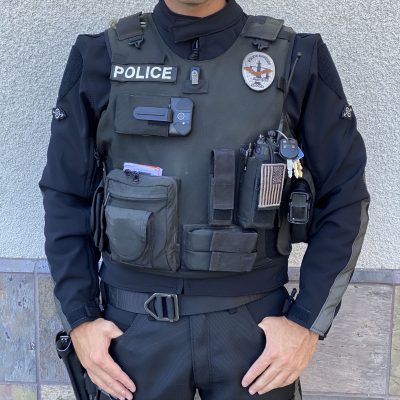
This screenshot has height=400, width=400. I want to click on keys, so click(293, 155).